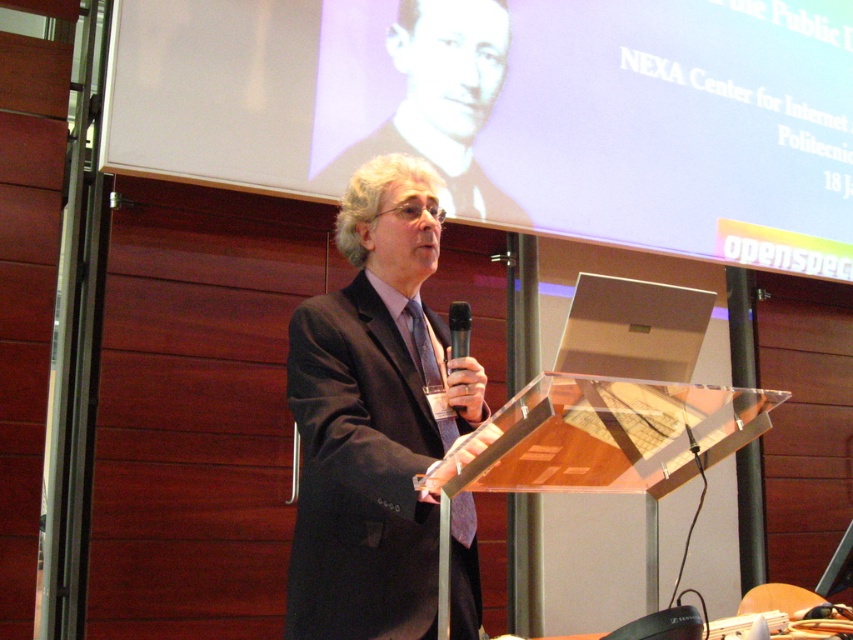
Question: Can you confirm if white matte projection screen at upper center is bigger than matte black suit at center?

Choices:
 (A) yes
 (B) no

Answer: (A)

Question: Estimate the real-world distances between objects in this image. Which object is closer to the blue silk tie at center?

Choices:
 (A) white matte projection screen at upper center
 (B) matte black suit at center

Answer: (B)

Question: Can you confirm if transparent acrylic podium at center is positioned to the left of blue silk tie at center?

Choices:
 (A) no
 (B) yes

Answer: (A)

Question: Which is nearer to the transparent acrylic podium at center?

Choices:
 (A) black plastic microphone at center
 (B) blue silk tie at center
 (C) white matte projection screen at upper center
 (D) dark suit at center

Answer: (D)

Question: Which point is closer to the camera?

Choices:
 (A) transparent acrylic podium at center
 (B) black plastic microphone at center
 (C) dark suit at center
 (D) white matte projection screen at upper center

Answer: (A)

Question: Can you confirm if transparent acrylic podium at center is positioned above black plastic microphone at center?

Choices:
 (A) no
 (B) yes

Answer: (A)